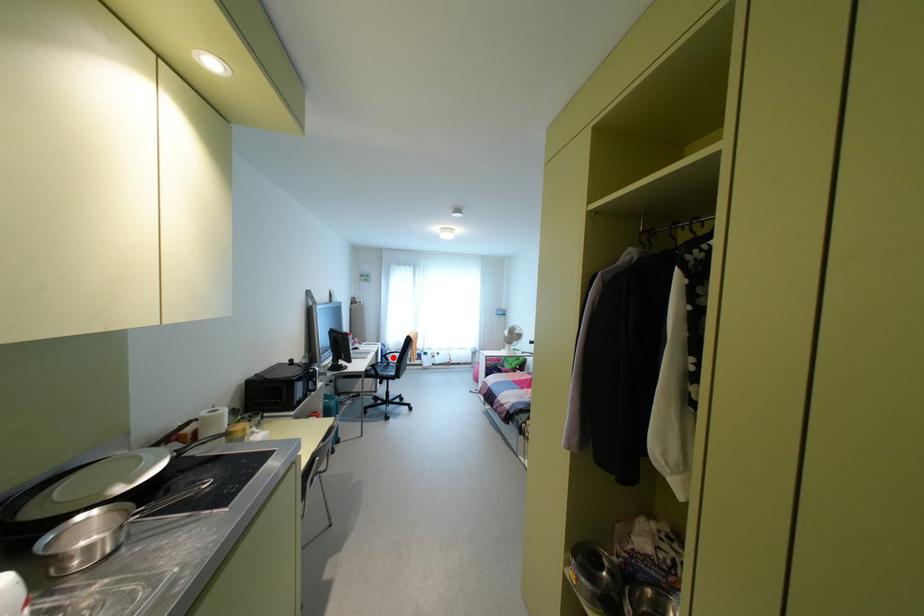
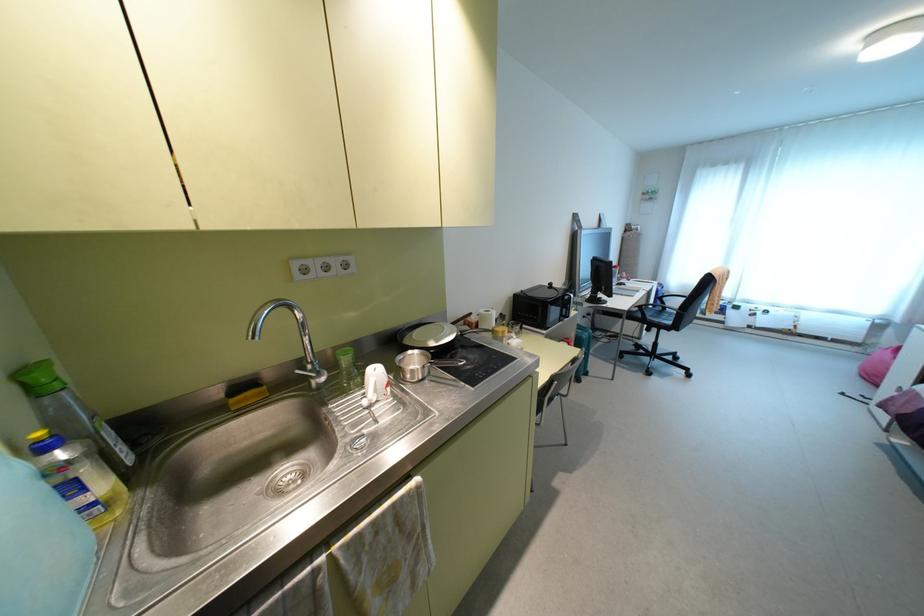
In the second image, find the point that corresponds to the highlighted location in the first image.

(674, 302)